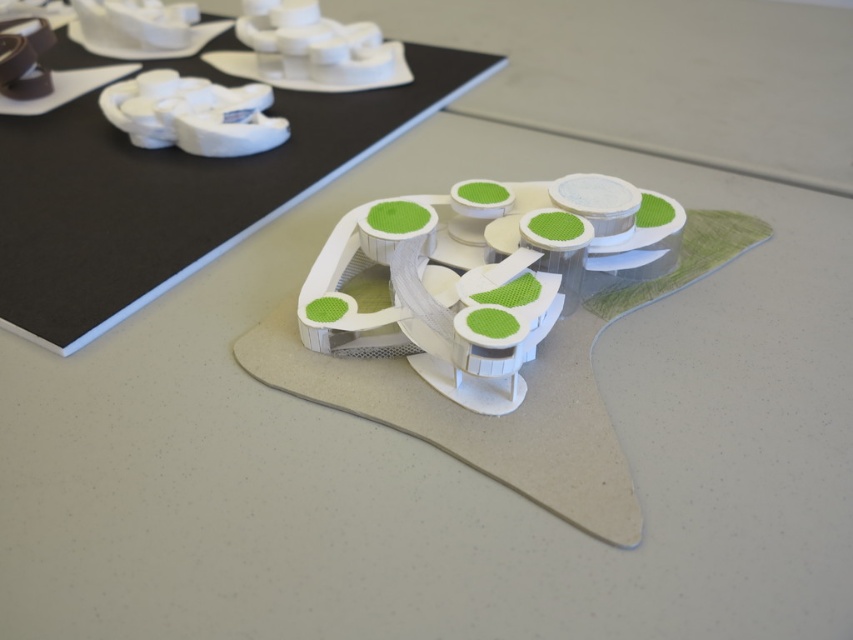
Which of these two, white textured toy at center or white matte toy at upper left, stands shorter?

white matte toy at upper left is shorter.

Is white textured toy at center to the left of white matte toy at upper left from the viewer's perspective?

No, white textured toy at center is not to the left of white matte toy at upper left.

This screenshot has width=853, height=640. I want to click on white textured toy at center, so pos(483,275).

You are a GUI agent. You are given a task and a screenshot of the screen. Output one action in this format:
    pyautogui.click(x=<x>, y=<y>)
    Task: Click on the white textured toy at center
    
    Given the screenshot: What is the action you would take?
    pyautogui.click(x=483, y=275)